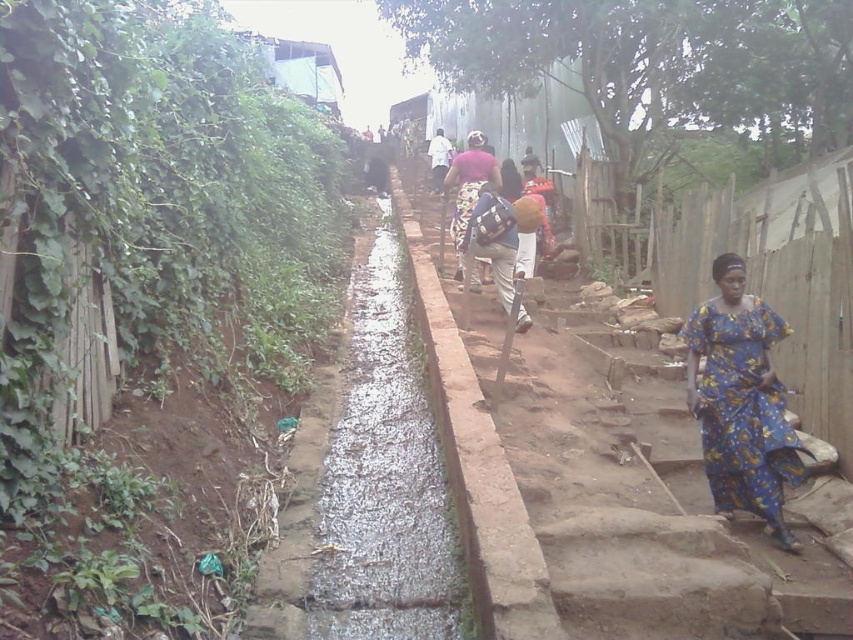
You are standing at the bottom of the pathway and want to cross to the other side. The wet concrete creek at center is in your way. Can you step over it? Please explain your reasoning based on its position.

The wet concrete creek at center is located at point (364,484), which is directly in the middle of the pathway. Since it spans the entire width, stepping over it would be difficult and unsafe. Consider finding an alternative path around it.

You are standing on the pathway and see the concrete steps at center and the matte pink fabric at center. Which object is positioned to the right side from your perspective?

The concrete steps at center are to the right of the matte pink fabric at center, so the concrete steps at center are positioned to the right side.

You are a delivery person carrying a large package that is 1.5 meters wide. You need to navigate through the narrow pathway shown in the image. Can your package fit through the space between the concrete steps at center and the matte pink fabric at center?

The concrete steps at center are wider than the matte pink fabric at center. Since the package is 1.5 meters wide, it depends on the combined width of both objects. However, since the steps are wider, the total width might accommodate the package. Without exact measurements, it is uncertain, but the steps being wider could mean there is enough space.